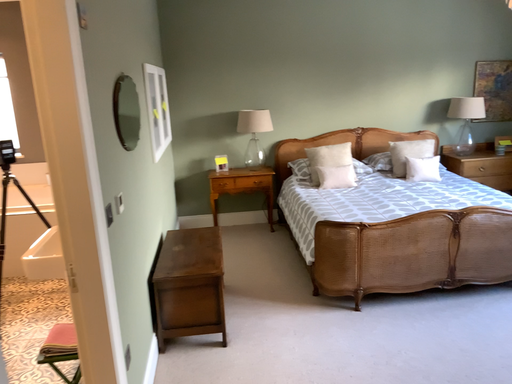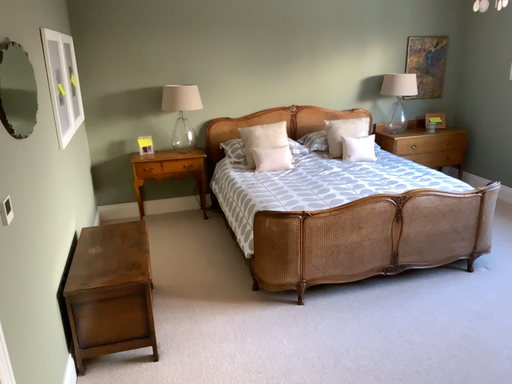
Question: Which way did the camera rotate in the video?

Choices:
 (A) rotated right
 (B) rotated left

Answer: (A)